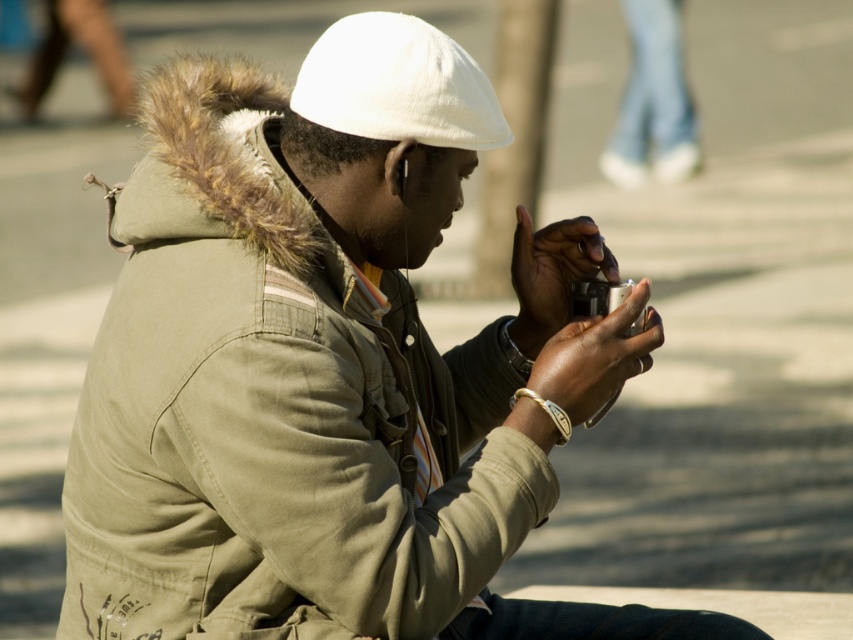
You are a photographer trying to capture a clear photo of the silver metallic camera at center without the white fabric hat at upper center blocking it. Since the hat is much taller than the camera, what adjustment could you make to your camera angle to ensure the hat doesn not obstruct the view?

Since the white fabric hat at upper center is much taller than the silver metallic camera at center, you can lower your camera angle to shoot from below the hat, ensuring the hat does not block the view of the camera.

You are a photographer trying to capture the perfect shot of the person using the device. You need to adjust your camera settings based on the positions of two points in the scene. The first point is at coordinates point (372,44), and the second point is at point (596,278). Which point should you focus on to ensure the subject is sharp if you want to prioritize the foreground?

You should focus on point (372,44) because it is in front of point (596,278), making it closer to the camera and thus the foreground subject.

You are a photographer trying to capture a clear shot of the silver metallic camera at center. However, the white fabric hat at upper center is blocking your view. Can you adjust your angle to avoid the hat while still focusing on the camera?

The white fabric hat at upper center is above the silver metallic camera at center, so you can lower your angle slightly to avoid the hat while keeping the camera in focus.